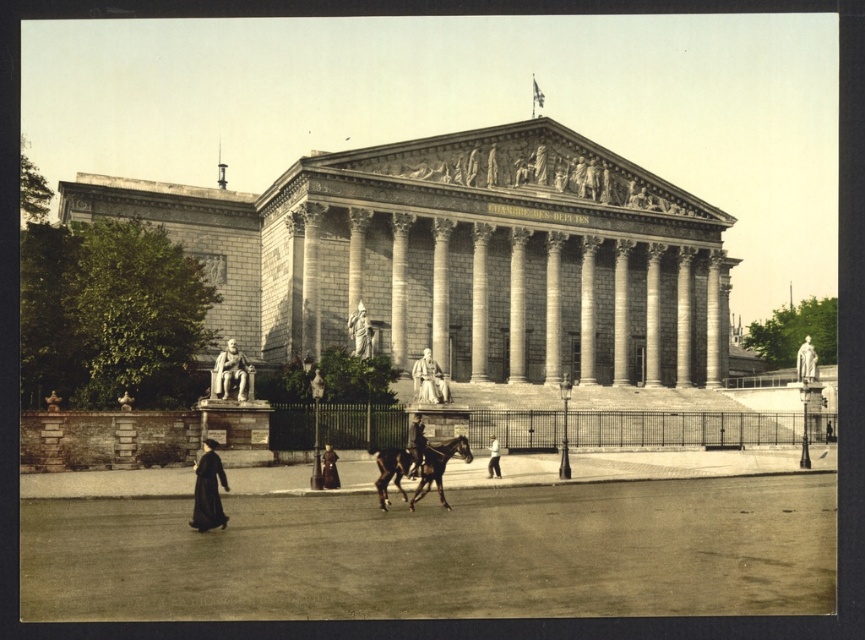
You are standing in front of the grand neoclassical building and want to take a photo of the smooth stone column at center. If your camera has a maximum focus range of 300 feet, will it be able to focus on the column?

The smooth stone column at center is 304.62 feet away from the camera. Since the camera can only focus up to 300 feet, it will not be able to focus on the column.

You are standing in front of the grand neoclassical building and want to take a photo that includes both the gray stone column at center and the stone statue at left. If your camera has a maximum focus range of 30 meters, will you be able to capture both in one shot?

The gray stone column at center is 32.65 meters away from the stone statue at left, which exceeds the camera maximum focus range of 30 meters. Therefore, you cannot capture both in one shot.

You are an architect visiting the Chambre des Deputes. You notice the gray stone column at center and the stone statue at left. Which object is bigger in size?

The gray stone column at center has a larger size compared to the stone statue at left.